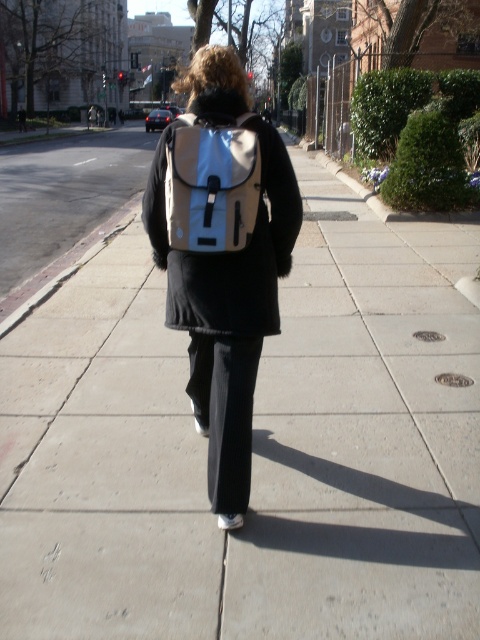
You are a delivery person who needs to check the contents of the beige fabric backpack at center and the white matte backpack at center. Since they are both at center, which one is easier to access?

The beige fabric backpack at center is positioned under the white matte backpack at center, so the white matte backpack at center is easier to access as it is on top.

You are a delivery person trying to deliver a package to the person walking away from the camera. You see the beige fabric backpack at center and the white matte backpack at center. Which backpack should you place the package in to ensure it stays visible and accessible?

You should place the package in the beige fabric backpack at center because it is closer to the viewer, making it more visible and accessible than the white matte backpack at center which is further away.